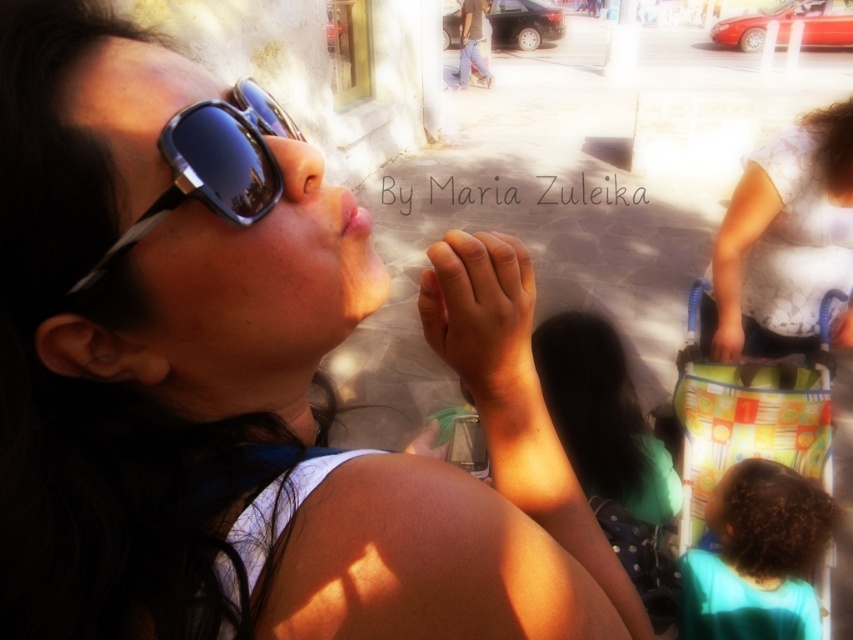
You are a photographer trying to capture a candid shot of the woman. You notice the white dotted shirt at upper right and the multicolored fabric baby carriage at lower right in the frame. How far apart are these two objects in the image?

The white dotted shirt at upper right is 10.54 inches from the multicolored fabric baby carriage at lower right.

You are a photographer trying to capture the perfect shot of the woman in the scene. You notice the smooth skin hand at center and the shiny black sunglasses at upper left. Which object should you focus on first if you want to ensure both are in the frame without adjusting your camera angle? Explain your reasoning based on their sizes.

The smooth skin hand at center has a smaller size compared to the shiny black sunglasses at upper left. Therefore, you should focus on the shiny black sunglasses at upper left first since it is larger and will be easier to frame initially, allowing the smaller hand to fit within the same shot without needing to adjust the angle.

You are a photographer trying to capture a candid shot of the woman in the scene. You notice the white dotted shirt at upper right and the multicolored fabric baby carriage at lower right in your viewfinder. Which object appears smaller in your camera frame?

The white dotted shirt at upper right appears smaller in the camera frame because it has a lesser height compared to the multicolored fabric baby carriage at lower right.